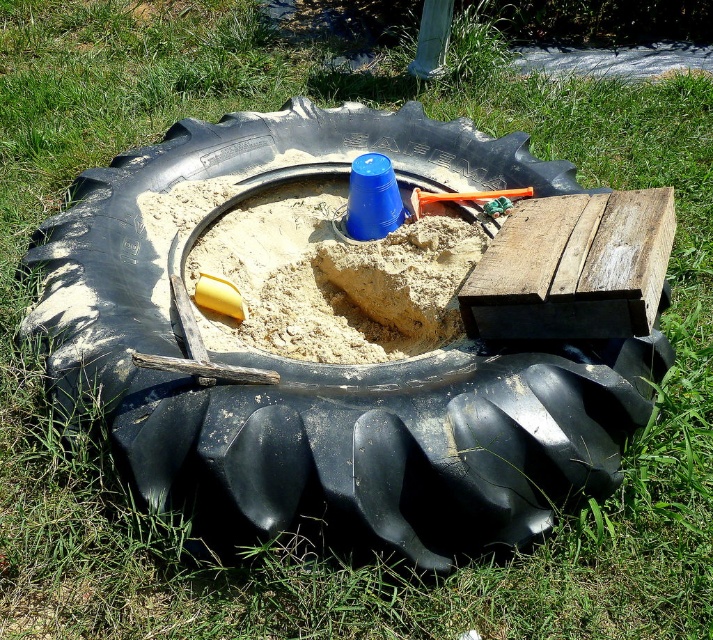
Question: Among these points, which one is farthest from the camera?

Choices:
 (A) (217, 264)
 (B) (270, 488)

Answer: (A)

Question: Is black rubber tire at center behind sandy yellow sand at center?

Choices:
 (A) no
 (B) yes

Answer: (A)

Question: Does black rubber tire at center have a smaller size compared to sandy yellow sand at center?

Choices:
 (A) no
 (B) yes

Answer: (A)

Question: Which of the following is the closest to the observer?

Choices:
 (A) (247, 323)
 (B) (267, 368)

Answer: (B)

Question: Can you confirm if black rubber tire at center is wider than sandy yellow sand at center?

Choices:
 (A) yes
 (B) no

Answer: (A)